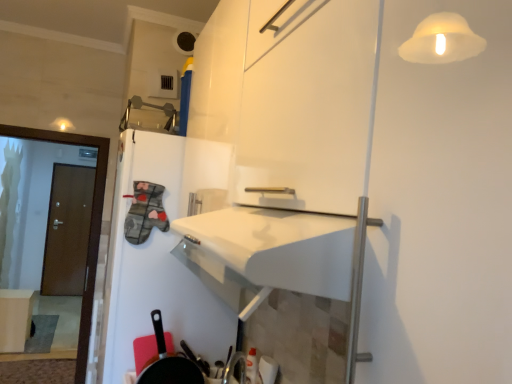
Describe the element at coordinates (91, 223) in the screenshot. Image resolution: width=512 pixels, height=384 pixels. I see `brown wooden door at left` at that location.

Find the location of `black matte frying pan at lower left`. black matte frying pan at lower left is located at coordinates (168, 363).

What do you see at coordinates (15, 319) in the screenshot? I see `matte white table at lower left` at bounding box center [15, 319].

Find the location of a particular element. Image resolution: width=512 pixels, height=384 pixels. brown wooden door at left is located at coordinates (91, 223).

Considering the sizes of objects black matte frying pan at lower left and brown wooden door at left in the image provided, who is taller, black matte frying pan at lower left or brown wooden door at left?

brown wooden door at left.

From the image's perspective, would you say black matte frying pan at lower left is positioned over brown wooden door at left?

Incorrect, from the image's perspective, black matte frying pan at lower left is lower than brown wooden door at left.

Considering the positions of objects black matte frying pan at lower left and brown wooden door at left in the image provided, who is more to the left, black matte frying pan at lower left or brown wooden door at left?

Positioned to the left is brown wooden door at left.

Based on the photo, does brown wooden door at left come behind matte white table at lower left?

No, it is in front of matte white table at lower left.

Measure the distance from brown wooden door at left to matte white table at lower left.

The distance of brown wooden door at left from matte white table at lower left is 6.00 feet.

Is brown wooden door at left oriented towards matte white table at lower left?

No, brown wooden door at left does not turn towards matte white table at lower left.

Is matte white table at lower left a part of brown wooden door at left?

No, matte white table at lower left is not inside brown wooden door at left.

Considering the sizes of objects black matte frying pan at lower left and brown wooden door at left in the image provided, who is taller, black matte frying pan at lower left or brown wooden door at left?

brown wooden door at left.

Is black matte frying pan at lower left in front of brown wooden door at left?

Yes, the depth of black matte frying pan at lower left is less than that of brown wooden door at left.

Looking at this image, from the image's perspective, does black matte frying pan at lower left appear lower than brown wooden door at left?

No, from the image's perspective, black matte frying pan at lower left is not below brown wooden door at left.

In the scene shown: Is black matte frying pan at lower left directly adjacent to brown wooden door at left?

No, black matte frying pan at lower left is not in contact with brown wooden door at left.

Which point is more forward, (x=59, y=295) or (x=26, y=326)?

The point (x=26, y=326) is closer to the camera.

Between brown wooden door at left and matte white table at lower left, which one has more height?

Standing taller between the two is brown wooden door at left.

From the image's perspective, is brown wooden door at left positioned above or below matte white table at lower left?

Clearly, from the image's perspective, brown wooden door at left is above matte white table at lower left.

Does brown wooden door at left have a lesser width compared to matte white table at lower left?

Correct, the width of brown wooden door at left is less than that of matte white table at lower left.

Considering the relative sizes of matte white table at lower left and brown wooden door at left in the image provided, is matte white table at lower left shorter than brown wooden door at left?

Yes, matte white table at lower left is shorter than brown wooden door at left.

How much distance is there between matte white table at lower left and brown wooden door at left?

They are 6.18 feet apart.

Between matte white table at lower left and brown wooden door at left, which one has smaller width?

Thinner between the two is brown wooden door at left.

Which is farther, [31,316] or [60,293]?

Point [60,293]

Is black matte frying pan at lower left at the back of brown wooden door at left?

No, black matte frying pan at lower left is not at the back of brown wooden door at left.

From a real-world perspective, which is physically above, brown wooden door at left or black matte frying pan at lower left?

brown wooden door at left is physically above.

Can black matte frying pan at lower left be found inside brown wooden door at left?

No, black matte frying pan at lower left is not inside brown wooden door at left.

From the image's perspective, is brown wooden door at left beneath black matte frying pan at lower left?

No, from the image's perspective, brown wooden door at left is not below black matte frying pan at lower left.

Is brown wooden door at left touching brown wooden door at left?

No, brown wooden door at left is not touching brown wooden door at left.

From a real-world perspective, relative to brown wooden door at left, is brown wooden door at left vertically above or below?

brown wooden door at left is situated lower than brown wooden door at left in the real world.

Could you tell me if brown wooden door at left is turned towards brown wooden door at left?

Yes, brown wooden door at left is oriented towards brown wooden door at left.

Considering the points (54, 217) and (99, 221), which point is behind, point (54, 217) or point (99, 221)?

The point (54, 217) is more distant.

You are a GUI agent. You are given a task and a screenshot of the screen. Output one action in this format:
    pyautogui.click(x=<x>, y=<y>)
    Task: Click on the frying pan on the right of brown wooden door at left
    This screenshot has width=512, height=384.
    Given the screenshot: What is the action you would take?
    pyautogui.click(x=168, y=363)

Where is `screen door above the matte white table at lower left (from the image's perspective)`? screen door above the matte white table at lower left (from the image's perspective) is located at coordinates (91, 223).

Considering their positions, is brown wooden door at left positioned further to black matte frying pan at lower left than matte white table at lower left?

Based on the image, matte white table at lower left appears to be further to black matte frying pan at lower left.

Considering their positions, is brown wooden door at left positioned further to black matte frying pan at lower left than matte white table at lower left?

The object further to black matte frying pan at lower left is brown wooden door at left.

Considering their positions, is matte white table at lower left positioned further to black matte frying pan at lower left than brown wooden door at left?

matte white table at lower left.

When comparing their distances from matte white table at lower left, does brown wooden door at left or brown wooden door at left seem closer?

brown wooden door at left is positioned closer to the anchor matte white table at lower left.

Looking at the image, which one is located closer to black matte frying pan at lower left, matte white table at lower left or brown wooden door at left?

matte white table at lower left.

Based on their spatial positions, is black matte frying pan at lower left or brown wooden door at left further from matte white table at lower left?

The object further to matte white table at lower left is black matte frying pan at lower left.

Estimate the real-world distances between objects in this image. Which object is closer to matte white table at lower left, black matte frying pan at lower left or brown wooden door at left?

brown wooden door at left lies closer to matte white table at lower left than the other object.

Based on their spatial positions, is brown wooden door at left or black matte frying pan at lower left further from brown wooden door at left?

Among the two, brown wooden door at left is located further to brown wooden door at left.

Locate an element on the screen. The image size is (512, 384). table between black matte frying pan at lower left and brown wooden door at left along the z-axis is located at coordinates (15, 319).

I want to click on screen door located between black matte frying pan at lower left and matte white table at lower left in the depth direction, so click(91, 223).

The width and height of the screenshot is (512, 384). What are the coordinates of `table between brown wooden door at left and brown wooden door at left along the z-axis` in the screenshot? It's located at (15, 319).

Locate an element on the screen. The image size is (512, 384). screen door between black matte frying pan at lower left and brown wooden door at left in the front-back direction is located at coordinates (91, 223).